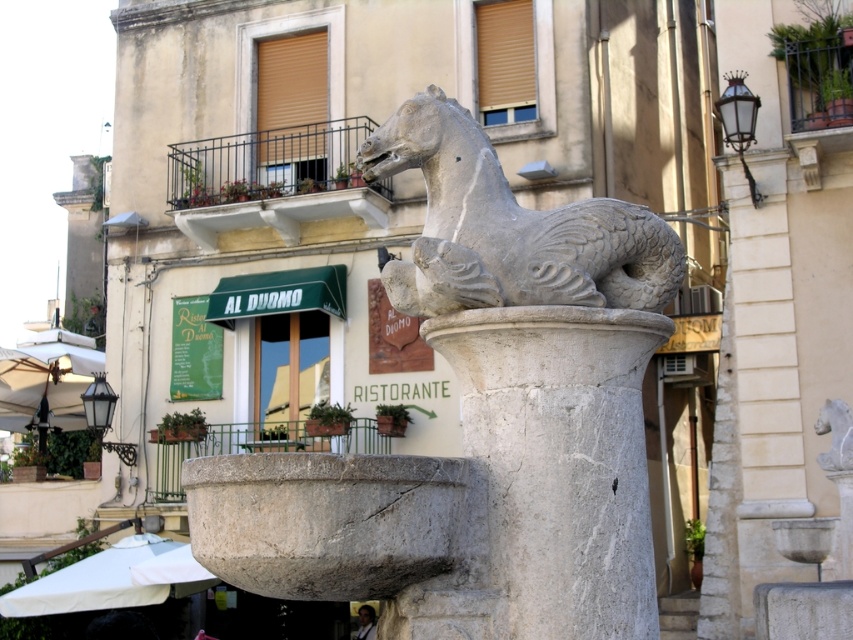
Which of these two, white marble horse at center or gray stone horse at center, stands taller?

Standing taller between the two is gray stone horse at center.

Can you confirm if white marble horse at center is positioned to the right of gray stone horse at center?

Yes, white marble horse at center is to the right of gray stone horse at center.

Which is behind, point (461, 458) or point (596, 300)?

The point (596, 300) is more distant.

Locate an element on the screen. The width and height of the screenshot is (853, 640). white marble horse at center is located at coordinates (479, 420).

Can you confirm if white marble pillar at center is positioned above gray stone horse at center?

No, white marble pillar at center is not above gray stone horse at center.

Can you confirm if white marble pillar at center is positioned to the left of gray stone horse at center?

In fact, white marble pillar at center is to the right of gray stone horse at center.

Image resolution: width=853 pixels, height=640 pixels. Find the location of `white marble pillar at center`. white marble pillar at center is located at coordinates (561, 460).

Is white marble horse at center thinner than white marble pillar at center?

Correct, white marble horse at center's width is less than white marble pillar at center's.

Which is above, white marble horse at center or white marble pillar at center?

white marble pillar at center is above.

Find the location of a particular element. This screenshot has width=853, height=640. white marble horse at center is located at coordinates (479, 420).